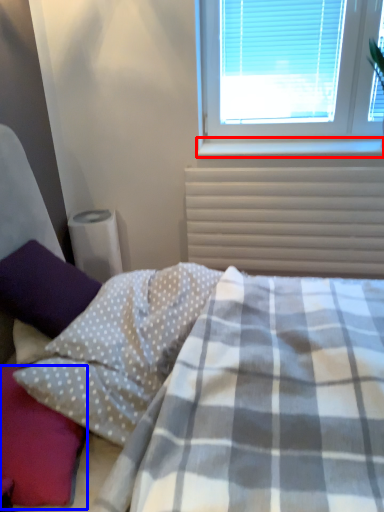
Question: Which object appears closest to the camera in this image, window sill (highlighted by a red box) or pillow (highlighted by a blue box)?

Choices:
 (A) window sill
 (B) pillow

Answer: (B)